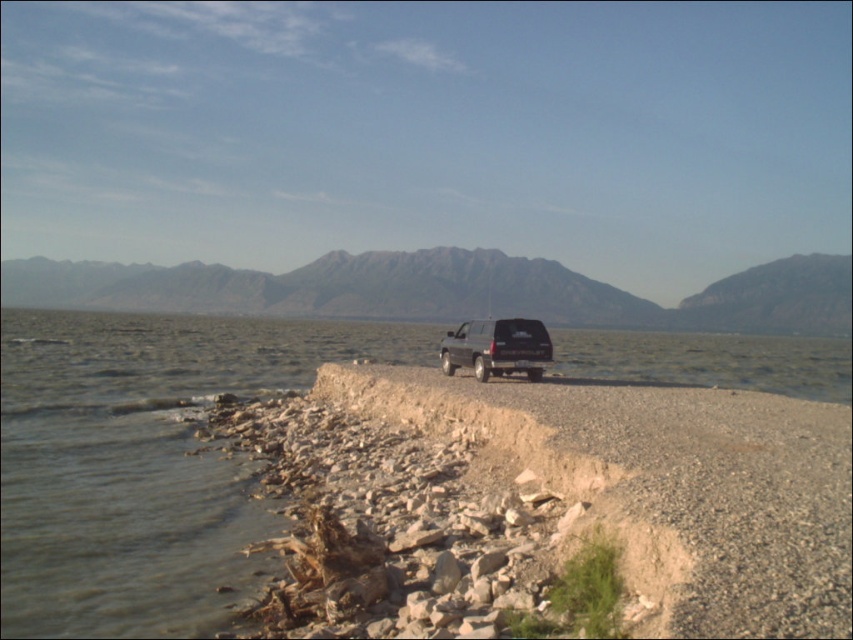
You are a photographer planning to capture the rugged granite mountain at center and the shiny black suv at center in a single frame. Based on their positions, will the mountain appear in front of or behind the SUV in the photo?

The rugged granite mountain at center is positioned over the shiny black suv at center, so in the photo, the mountain will appear in front of the SUV.

You are planning to take a photo of the rugged granite mountain at center and the shiny black suv at center from the shore. Which object will appear bigger in the photo?

The rugged granite mountain at center will appear bigger in the photo because it is larger in size than the shiny black suv at center.